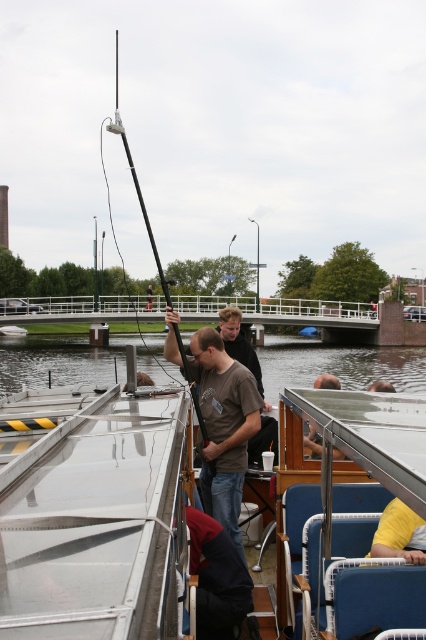
Is the position of white glossy boat at lower left less distant than that of yellow fabric at lower right?

That is True.

Between white glossy boat at lower left and yellow fabric at lower right, which one has more height?

With more height is white glossy boat at lower left.

Is point (109, 609) behind point (411, 536)?

No, (109, 609) is in front of (411, 536).

Locate an element on the screen. The image size is (426, 640). white glossy boat at lower left is located at coordinates (95, 516).

Between point (230, 371) and point (313, 435), which one is positioned in front?

Point (230, 371) is more forward.

Is brown cotton t-shirt at center above smooth brown wooden paddle at center?

Yes.

Measure the distance between brown cotton t-shirt at center and camera.

A distance of 12.85 feet exists between brown cotton t-shirt at center and camera.

You are a GUI agent. You are given a task and a screenshot of the screen. Output one action in this format:
    pyautogui.click(x=<x>, y=<y>)
    Task: Click on the brown cotton t-shirt at center
    
    Given the screenshot: What is the action you would take?
    pyautogui.click(x=224, y=426)

This screenshot has height=640, width=426. I want to click on white glossy boat at lower left, so tap(95, 516).

Which is in front, point (31, 394) or point (146, 307)?

Point (31, 394) is in front.

Identify the location of white glossy boat at lower left. (95, 516).